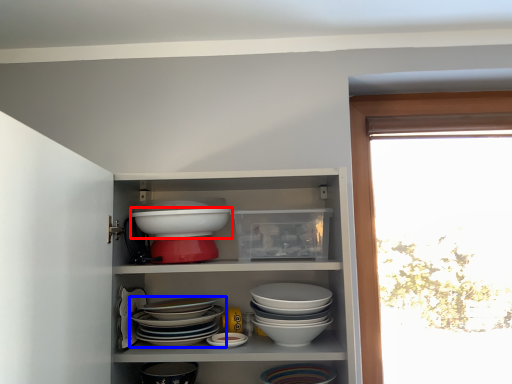
Question: Which of the following is the closest to the observer, bowl (highlighted by a red box) or bowl (highlighted by a blue box)?

Choices:
 (A) bowl
 (B) bowl

Answer: (B)